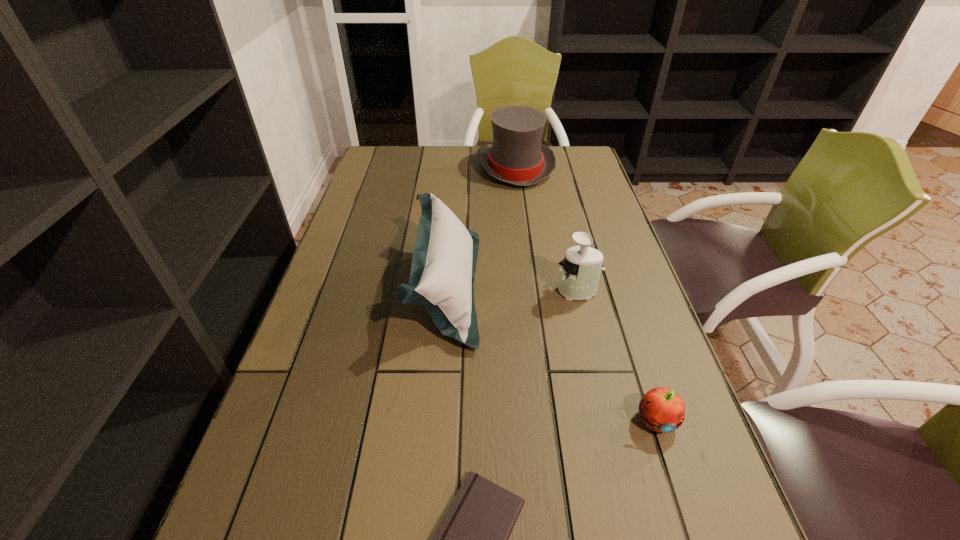
Identify the location of the farthest object. (516, 156).

This screenshot has height=540, width=960. Identify the location of juicer. (580, 273).

Image resolution: width=960 pixels, height=540 pixels. I want to click on cushion, so click(444, 260).

Image resolution: width=960 pixels, height=540 pixels. I want to click on the fourth tallest object, so click(663, 410).

At what (x,y) coordinates should I click in order to perform the action: click on the second nearest object. Please return your answer as a coordinate pair (x, y). The height and width of the screenshot is (540, 960). Looking at the image, I should click on (663, 410).

I want to click on free location located on the left of the farthest object, so point(386,167).

At what (x,y) coordinates should I click in order to perform the action: click on free space located 0.160m on the back of the juicer. Please return your answer as a coordinate pair (x, y). Looking at the image, I should click on (566, 243).

Identify the location of vacant region located 0.270m on the surface of the cushion. The height and width of the screenshot is (540, 960). (588, 287).

The image size is (960, 540). In order to click on vacant area located 0.180m on the left of the apple in this screenshot , I will do `click(536, 420)`.

This screenshot has height=540, width=960. What are the coordinates of `object present at the far edge` in the screenshot? It's located at (516, 156).